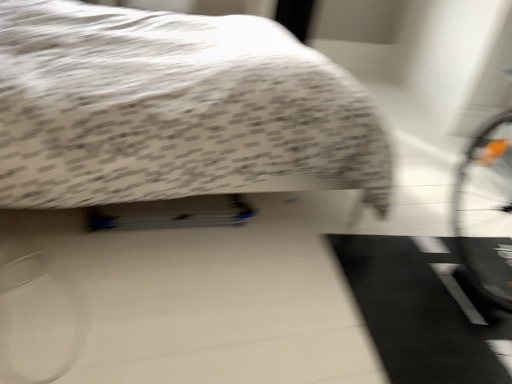
The width and height of the screenshot is (512, 384). I want to click on empty space that is in between white textured bed at upper center and black rubber doormat at lower right, so click(x=257, y=279).